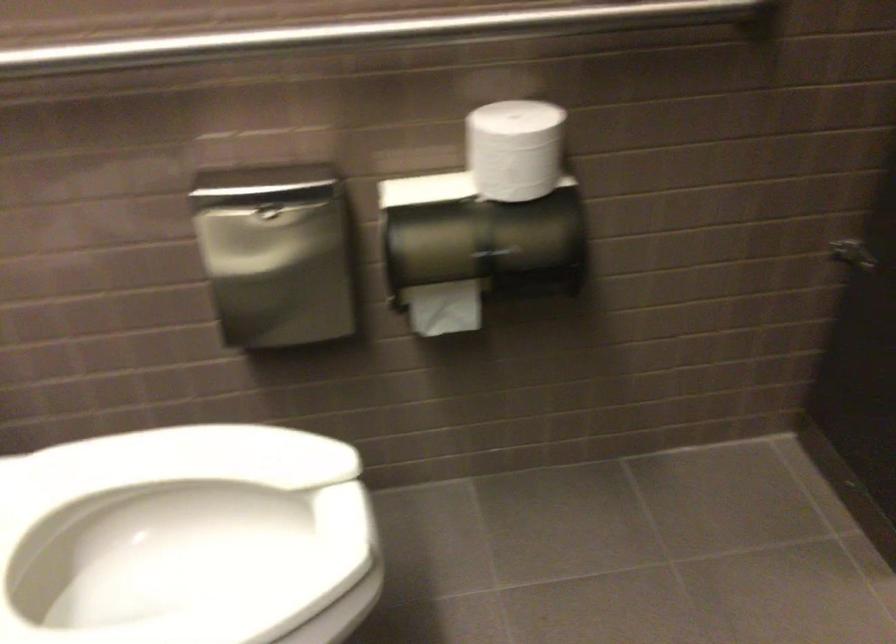
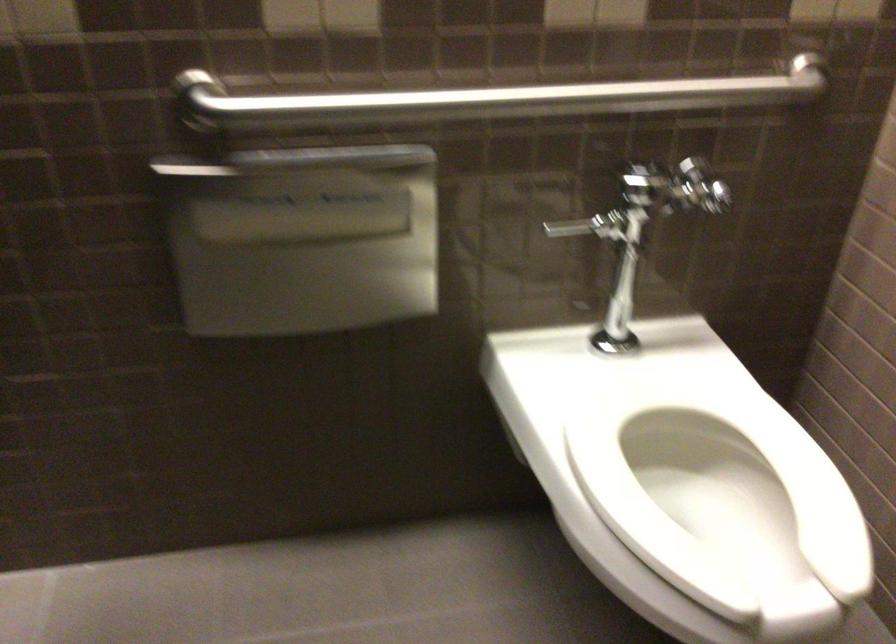
In the second image, find the point that corresponds to point 125,560 in the first image.

(719, 494)